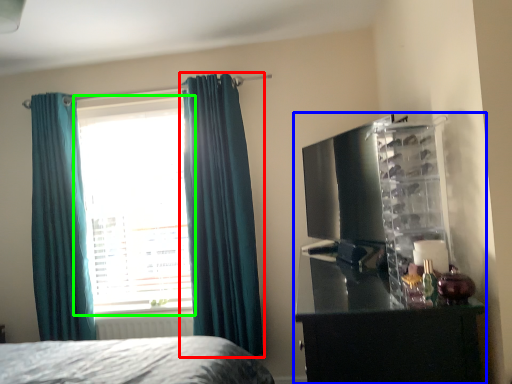
Question: Which is nearer to the curtain (highlighted by a red box)? entertainment center (highlighted by a blue box) or window (highlighted by a green box).

Choices:
 (A) entertainment center
 (B) window

Answer: (B)